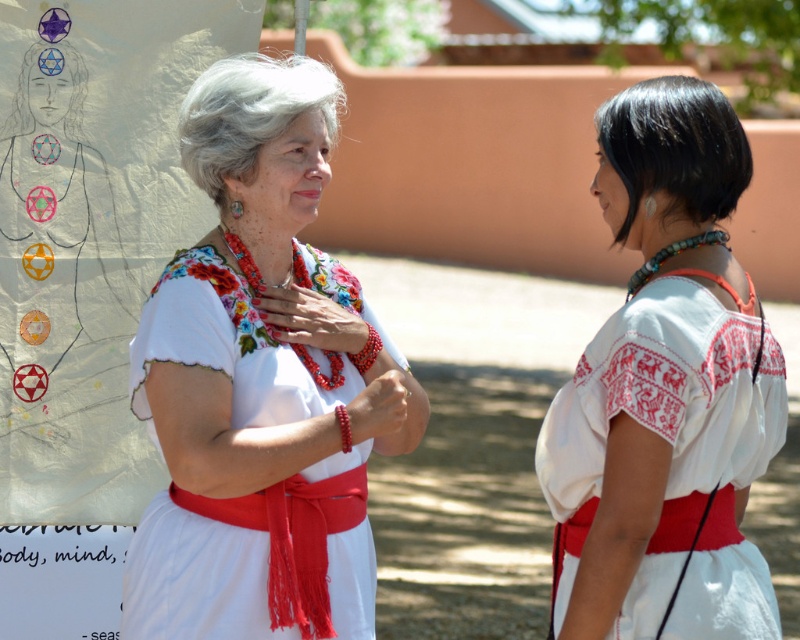
Does white embroidered blouse at center have a lesser height compared to white cotton dress at right?

No, white embroidered blouse at center is not shorter than white cotton dress at right.

Which is more to the left, white embroidered blouse at center or white cotton dress at right?

Positioned to the left is white embroidered blouse at center.

The image size is (800, 640). What do you see at coordinates (262, 384) in the screenshot?
I see `white embroidered blouse at center` at bounding box center [262, 384].

I want to click on white embroidered blouse at center, so 262,384.